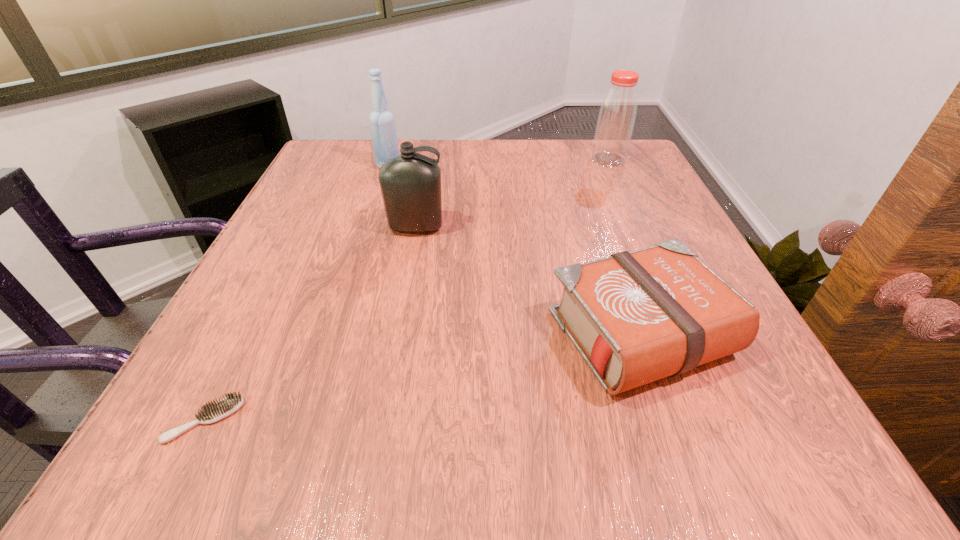
The image size is (960, 540). I want to click on object that is at the far right corner, so click(x=617, y=114).

What are the coordinates of `object that is at the near right corner` in the screenshot? It's located at (635, 317).

The height and width of the screenshot is (540, 960). In the image, there is a desktop. Find the location of `free space at the far edge`. free space at the far edge is located at coordinates (569, 155).

Where is `blank space at the near edge of the desktop`? blank space at the near edge of the desktop is located at coordinates (620, 424).

The image size is (960, 540). In the image, there is a desktop. Find the location of `vacant space at the left edge`. vacant space at the left edge is located at coordinates (320, 271).

Where is `free space at the right edge`? This screenshot has width=960, height=540. free space at the right edge is located at coordinates (629, 224).

You are a GUI agent. You are given a task and a screenshot of the screen. Output one action in this format:
    pyautogui.click(x=<x>, y=<y>)
    Task: Click on the vacant space at the far right corner
    This screenshot has width=960, height=540.
    Given the screenshot: What is the action you would take?
    pyautogui.click(x=632, y=165)

The height and width of the screenshot is (540, 960). I want to click on free space between the nearest bottle and the leftmost object, so click(x=310, y=324).

Identify the location of unoccupied position between the second object from left to right and the shortest object. This screenshot has width=960, height=540. (297, 293).

I want to click on free space between the scrubbing brush and the rightmost bottle, so click(x=406, y=290).